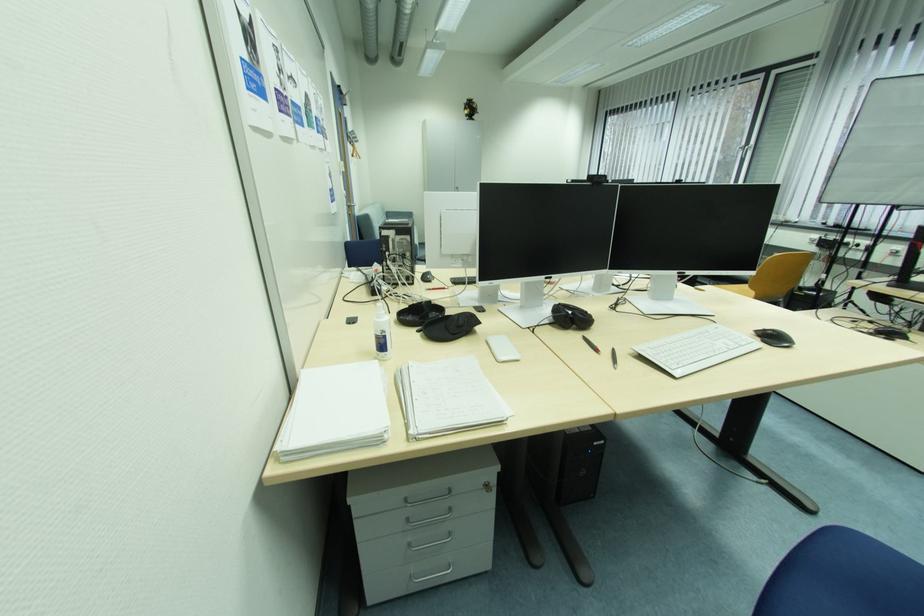
Where would you lift the black and red pen? Please return your answer as a coordinate pair (x, y).

(590, 344)